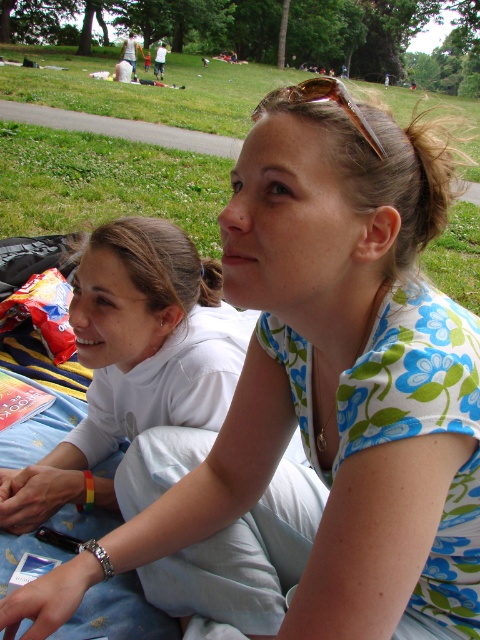
Question: Is green grass at upper center behind gold metallic sunglasses at upper center?

Choices:
 (A) yes
 (B) no

Answer: (A)

Question: Which point is farther to the camera?

Choices:
 (A) gold metallic sunglasses at upper center
 (B) green grass at upper center

Answer: (B)

Question: In this image, where is green grass at upper center located relative to gold metallic sunglasses at upper center?

Choices:
 (A) right
 (B) left

Answer: (A)

Question: Does green grass at upper center appear on the right side of gold metallic sunglasses at upper center?

Choices:
 (A) no
 (B) yes

Answer: (B)